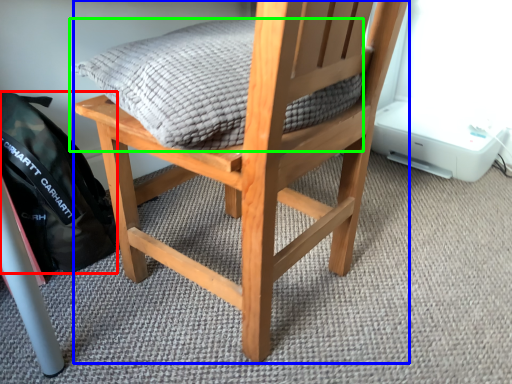
Question: Which is farther away from backpack (highlighted by a red box)? chair (highlighted by a blue box) or pillow (highlighted by a green box)?

Choices:
 (A) chair
 (B) pillow

Answer: (B)